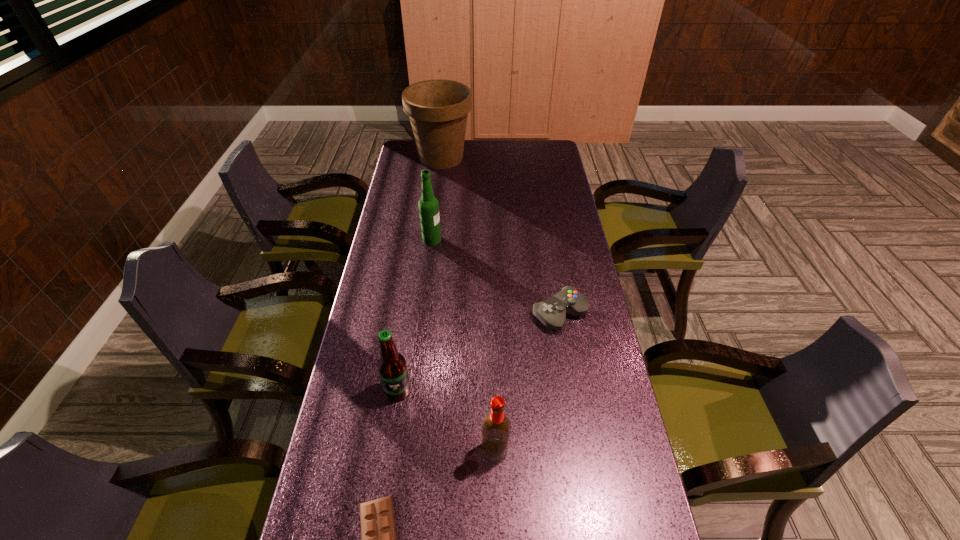
Locate an element on the screen. The image size is (960, 540). free location located 0.280m on the label of the second nearest beer bottle is located at coordinates (379, 516).

Find the location of a particular element. This screenshot has width=960, height=540. vacant space located 0.200m on the right of the second object from right to left is located at coordinates (589, 450).

The image size is (960, 540). What are the coordinates of `vacant space situated 0.380m on the back of the rightmost object` in the screenshot? It's located at (544, 224).

Locate an element on the screen. object at the far edge is located at coordinates (438, 109).

I want to click on flowerpot positioned at the left edge, so click(x=438, y=109).

Identify the location of object located in the right edge section of the desktop. This screenshot has width=960, height=540. (551, 312).

This screenshot has width=960, height=540. In order to click on object at the far left corner in this screenshot , I will do `click(438, 109)`.

Identify the location of free space at the far edge of the desktop. (513, 142).

Identify the location of vacant area at the left edge of the desktop. The width and height of the screenshot is (960, 540). (376, 409).

You are a GUI agent. You are given a task and a screenshot of the screen. Output one action in this format:
    pyautogui.click(x=<x>, y=<y>)
    Task: Click on the free space at the right edge of the desktop
    Image resolution: width=960 pixels, height=540 pixels.
    Given the screenshot: What is the action you would take?
    pyautogui.click(x=582, y=389)